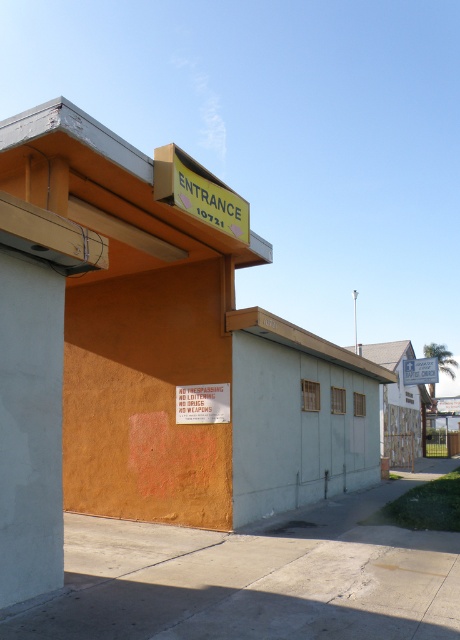
You are standing in front of the building and need to locate the entrance. Which object is positioned higher up on the building between the white concrete pillar at left and the yellow matte sign at upper center?

The yellow matte sign at upper center is positioned higher up on the building than the white concrete pillar at left.

You are standing at the entrance of the building and need to locate the address. Which sign should you look at first, the yellow matte sign at upper center or the white plastic sign at center?

The address is displayed on the yellow matte sign at upper center, which is positioned over the white plastic sign at center. Therefore, you should look at the yellow matte sign at upper center first to find the address.

You are standing in front of the building and notice the white concrete pillar at left and the white plastic sign at center. Which object is positioned higher relative to the other?

The white concrete pillar at left is positioned above the white plastic sign at center, so it is higher.